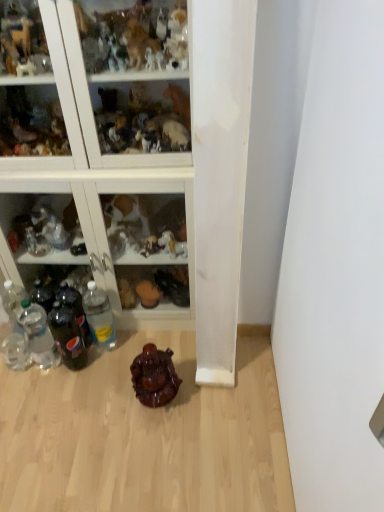
Question: Is clear glass bottles at left, the 1th shelf from the bottom, aimed at translucent glass figurines at upper center, the second shelf positioned from the bottom?

Choices:
 (A) yes
 (B) no

Answer: (B)

Question: Is clear glass bottles at left, the second shelf from the top, looking in the opposite direction of translucent glass figurines at upper center, the first shelf positioned from the top?

Choices:
 (A) no
 (B) yes

Answer: (A)

Question: Does clear glass bottles at left, the second shelf from the top, appear on the right side of translucent glass figurines at upper center, the first shelf positioned from the top?

Choices:
 (A) no
 (B) yes

Answer: (A)

Question: From a real-world perspective, is clear glass bottles at left, the second shelf from the top, located beneath translucent glass figurines at upper center, the first shelf positioned from the top?

Choices:
 (A) yes
 (B) no

Answer: (A)

Question: Considering the relative sizes of clear glass bottles at left, the 1th shelf from the bottom, and translucent glass figurines at upper center, the first shelf positioned from the top, in the image provided, is clear glass bottles at left, the 1th shelf from the bottom, thinner than translucent glass figurines at upper center, the first shelf positioned from the top,?

Choices:
 (A) no
 (B) yes

Answer: (A)

Question: Looking at their shapes, would you say shiny brown statue at center is wider or thinner than clear plastic bottles at left, the fifth bottle positioned from the right?

Choices:
 (A) thin
 (B) wide

Answer: (B)

Question: From a real-world perspective, is shiny brown statue at center above or below clear plastic bottles at left, the 1th bottle from the left?

Choices:
 (A) above
 (B) below

Answer: (B)

Question: From their relative heights in the image, would you say shiny brown statue at center is taller or shorter than clear plastic bottles at left, the 1th bottle from the left?

Choices:
 (A) tall
 (B) short

Answer: (B)

Question: Based on their positions, is shiny brown statue at center located to the left or right of clear plastic bottles at left, the 1th bottle from the left?

Choices:
 (A) right
 (B) left

Answer: (A)

Question: Is point (x=157, y=396) positioned closer to the camera than point (x=77, y=362)?

Choices:
 (A) farther
 (B) closer

Answer: (B)

Question: From their relative heights in the image, would you say shiny brown statue at center is taller or shorter than dark glass bottle at lower left, which is the 4th bottle in left-to-right order?

Choices:
 (A) short
 (B) tall

Answer: (A)

Question: Would you say shiny brown statue at center is inside or outside dark glass bottle at lower left, which is the 4th bottle in left-to-right order?

Choices:
 (A) outside
 (B) inside

Answer: (A)

Question: Relative to dark glass bottle at lower left, which is the 4th bottle in left-to-right order, is shiny brown statue at center in front or behind?

Choices:
 (A) front
 (B) behind

Answer: (A)

Question: From a real-world perspective, is clear plastic bottle at lower left, the fifth bottle viewed from the left, physically located above or below dark glass bottle at lower left, which is the 4th bottle in left-to-right order?

Choices:
 (A) below
 (B) above

Answer: (A)

Question: Is clear plastic bottle at lower left, the fifth bottle viewed from the left, taller or shorter than dark glass bottle at lower left, the second bottle in the right-to-left sequence?

Choices:
 (A) short
 (B) tall

Answer: (B)